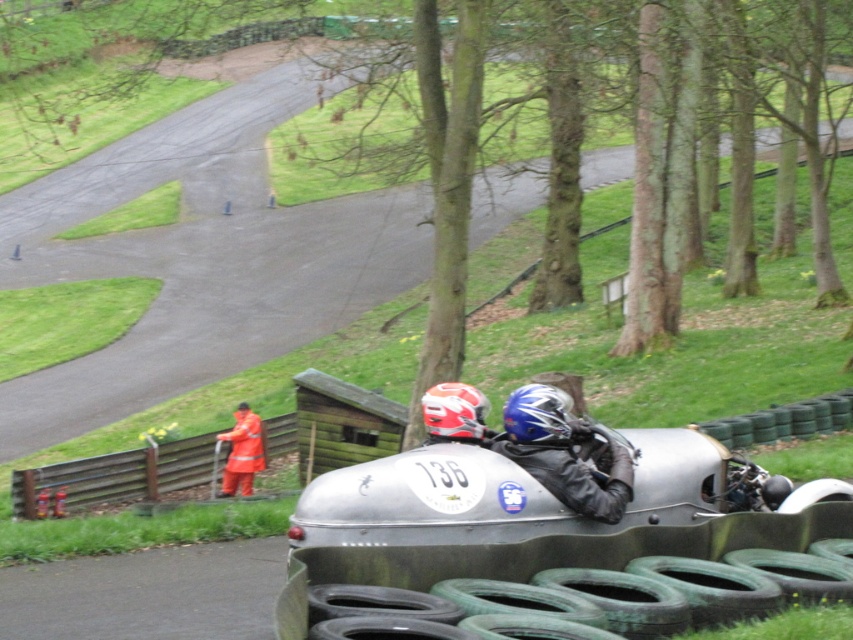
You are a photographer standing at the starting line of the vintage sidecar race. You want to capture a closeup shot of the shiny blue helmet at center. Given that your camera can focus on objects within 10 meters, will you be able to take the photo without moving closer?

The shiny blue helmet at center is 10.84 meters from the camera. Since the camera can focus on objects within 10 meters, you will need to move closer to take the closeup shot.

You are a spectator at the vintage sidecar race and want to locate the blue matte helmet at center. According to the coordinates provided, where exactly would you look in the image?

The blue matte helmet at center is located at point coordinates of [537,413].

You are a photographer at the vintage sidecar race event. You want to capture a photo where the shiny blue helmet at center and the orange reflective jacket at center are both visible. Based on their heights, which object should be placed closer to the front of the frame to ensure both are fully visible?

The shiny blue helmet at center is shorter than the orange reflective jacket at center. To ensure both are fully visible in the photo, the shorter shiny blue helmet at center should be placed closer to the front of the frame so that the taller orange reflective jacket at center doesn